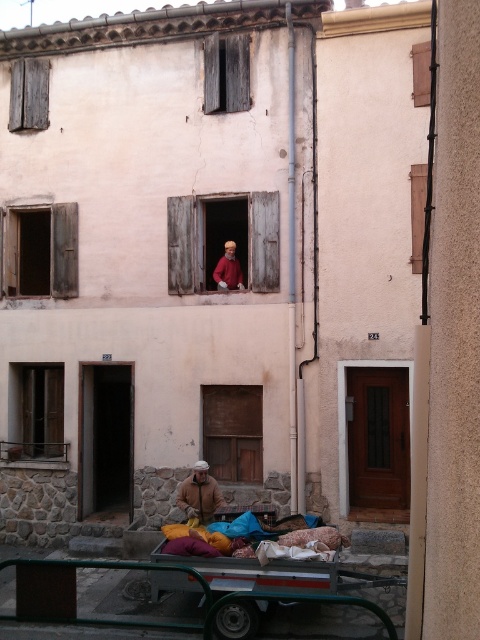
Who is more forward, (14, 113) or (423, 227)?

Point (423, 227) is in front.

Does wooden shutter at upper left have a lesser height compared to wooden at right?

Yes.

Between point (34, 81) and point (418, 225), which one is positioned behind?

The point (34, 81) is more distant.

Where is `wooden shutter at upper left`? This screenshot has height=640, width=480. wooden shutter at upper left is located at coordinates (28, 93).

Is wooden window at lower left below brown fuzzy jacket at lower center?

No.

Can you confirm if wooden window at lower left is shorter than brown fuzzy jacket at lower center?

No.

The width and height of the screenshot is (480, 640). Describe the element at coordinates (40, 413) in the screenshot. I see `wooden window at lower left` at that location.

Find the location of `wooden window at lower left`. wooden window at lower left is located at coordinates (40, 413).

Which is in front, point (238, 436) or point (420, 240)?

Point (420, 240) is more forward.

Based on the photo, is brown wooden window at center shorter than wooden at right?

Indeed, brown wooden window at center has a lesser height compared to wooden at right.

Does point (245, 417) come closer to viewer compared to point (417, 241)?

No, it is behind (417, 241).

Where is `brown wooden window at center`? brown wooden window at center is located at coordinates (232, 433).